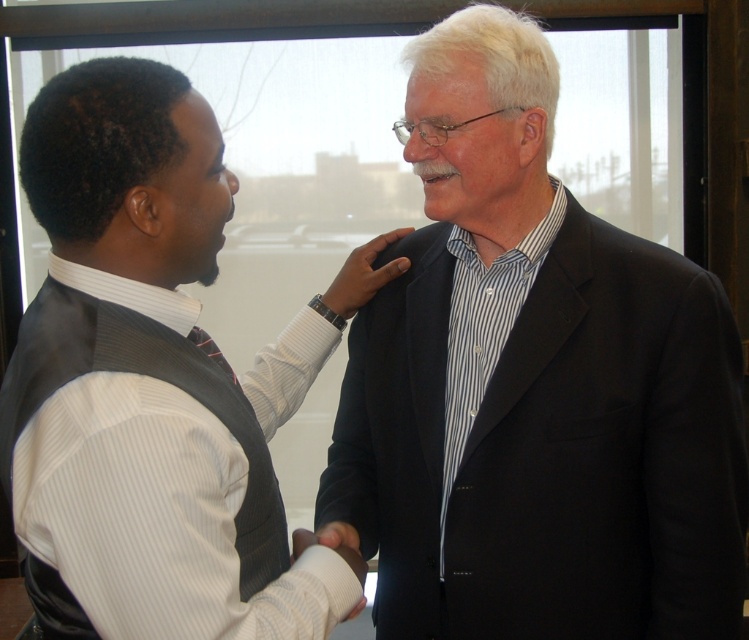
You are a photographer taking a closeup shot of the handshake between the two people. You want to focus on the hand and tie in the scene. Which object is closer to your camera lens? Please choose between the white fabric hand at center and the black silk tie at center.

The white fabric hand at center is closer to the camera lens because it is further to the viewer than the black silk tie at center.

Consider the image. What is located at the coordinate point (539,403) in the image?

The black matte suit at center is located at the coordinate point (539,403).

You are a photographer trying to capture the handshake between the two people in the image. You want to ensure that the white fabric hand at center and the black silk tie at center are both clearly visible in the photo. Based on their positions, which object is closer to the camera?

The white fabric hand at center is positioned under the black silk tie at center, so the hand is closer to the camera than the tie.